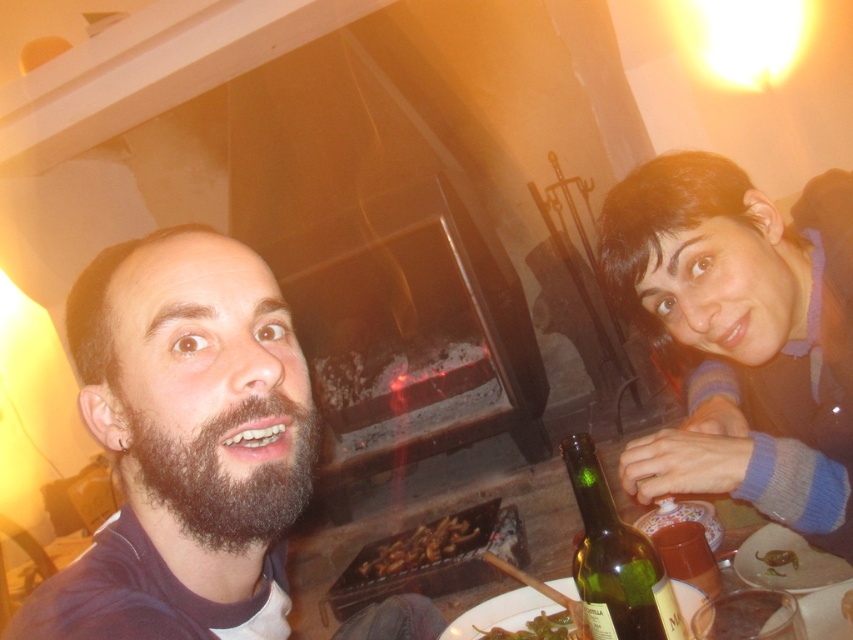
Question: Can you confirm if dark brown beard at center is smaller than green leafy vegetable at lower center?

Choices:
 (A) yes
 (B) no

Answer: (B)

Question: From the image, what is the correct spatial relationship of smooth blue sweater at right in relation to green leafy vegetable at lower center?

Choices:
 (A) below
 (B) above

Answer: (B)

Question: Which point is closer to the camera taking this photo?

Choices:
 (A) (839, 364)
 (B) (711, 556)
 (C) (398, 552)

Answer: (A)

Question: Which object is positioned farthest from the green glass bottle at lower right?

Choices:
 (A) smooth blue sweater at right
 (B) dark brown beard at center
 (C) brown crispy bread at center
 (D) green glass bottle at lower center

Answer: (C)

Question: Which object is farther from the camera taking this photo?

Choices:
 (A) dark brown beard at center
 (B) shiny brown meat at lower right
 (C) green glass bottle at lower center
 (D) green leafy vegetable at lower center

Answer: (B)

Question: Can you confirm if brown crispy bread at center is positioned above green glass bottle at lower center?

Choices:
 (A) no
 (B) yes

Answer: (A)